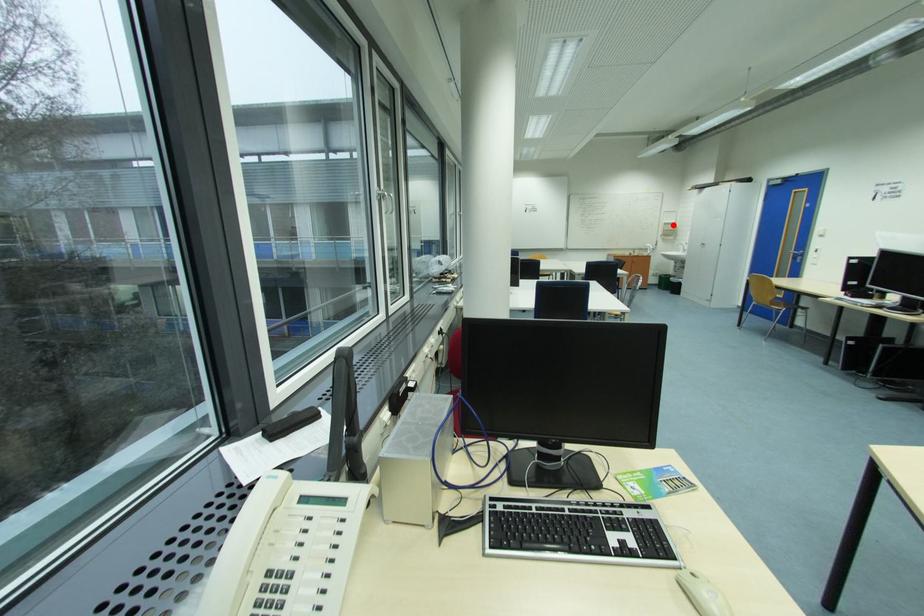
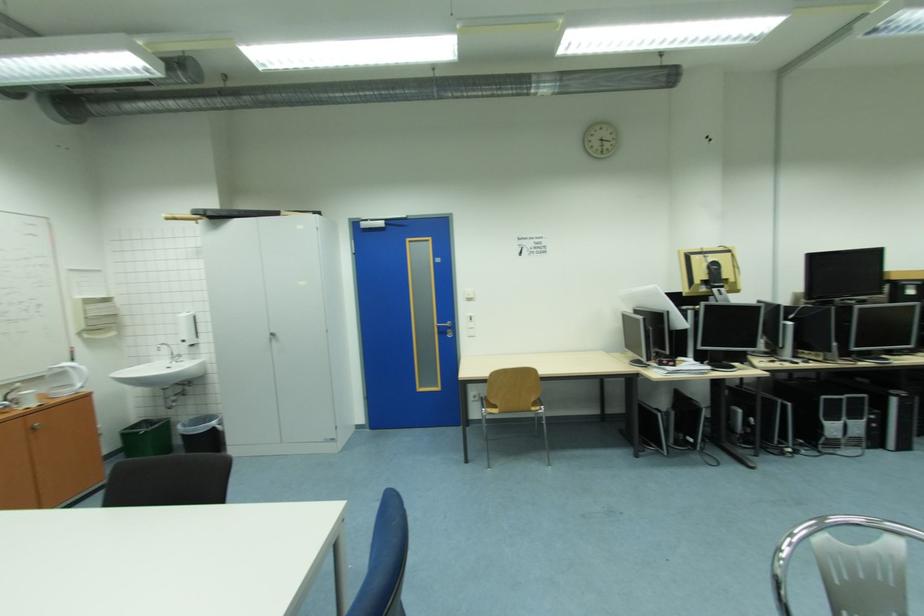
Question: I am providing you with two images of the same scene from different viewpoints. In image1, a red point is highlighted. Considering the same 3D point in image2, which of the following is correct?

Choices:
 (A) It is closer
 (B) It is farther

Answer: (B)